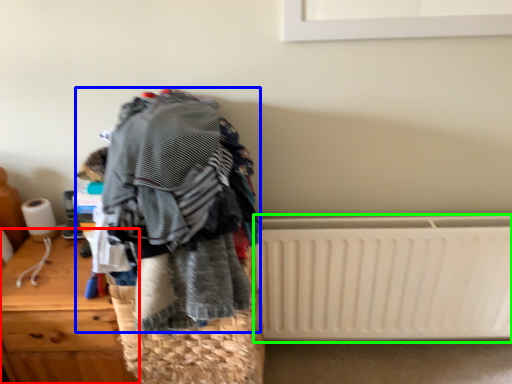
Question: Which is farther away from furniture (highlighted by a red box)? textile (highlighted by a blue box) or radiator (highlighted by a green box)?

Choices:
 (A) textile
 (B) radiator

Answer: (B)